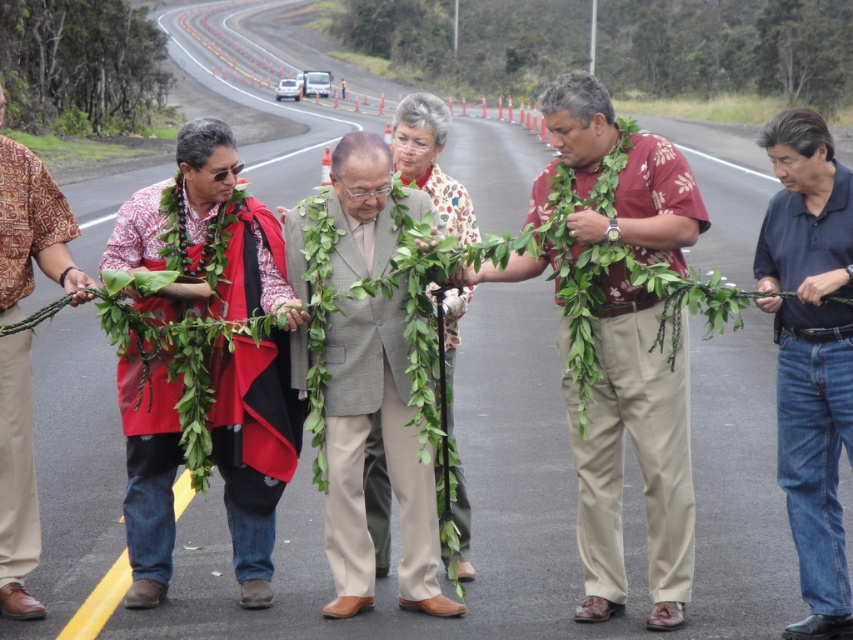
Question: Can you confirm if printed fabric shirt at center is smaller than green leafy lei at center?

Choices:
 (A) no
 (B) yes

Answer: (A)

Question: Is matte red shawl at center above gray suit at center?

Choices:
 (A) yes
 (B) no

Answer: (A)

Question: Which object is farther from the camera taking this photo?

Choices:
 (A) green leafy lei at center
 (B) matte red shawl at center

Answer: (B)

Question: Which point appears closest to the camera in this image?

Choices:
 (A) (38, 220)
 (B) (728, 104)

Answer: (A)

Question: Among these points, which one is nearest to the camera?

Choices:
 (A) (102, 308)
 (B) (338, 468)
 (C) (144, 540)

Answer: (A)

Question: Can you confirm if green leafy lei at center is positioned to the left of matte red shirt at left?

Choices:
 (A) no
 (B) yes

Answer: (A)